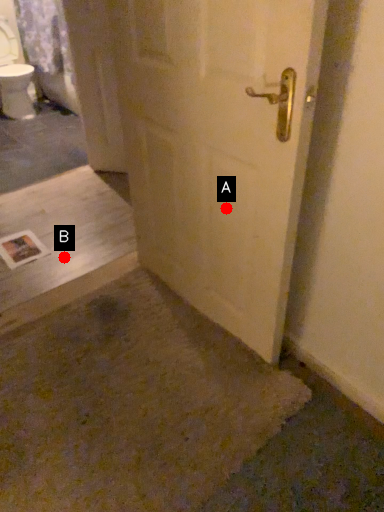
Question: Two points are circled on the image, labeled by A and B beside each circle. Which of the following is the closest to the observer?

Choices:
 (A) A is closer
 (B) B is closer

Answer: (A)